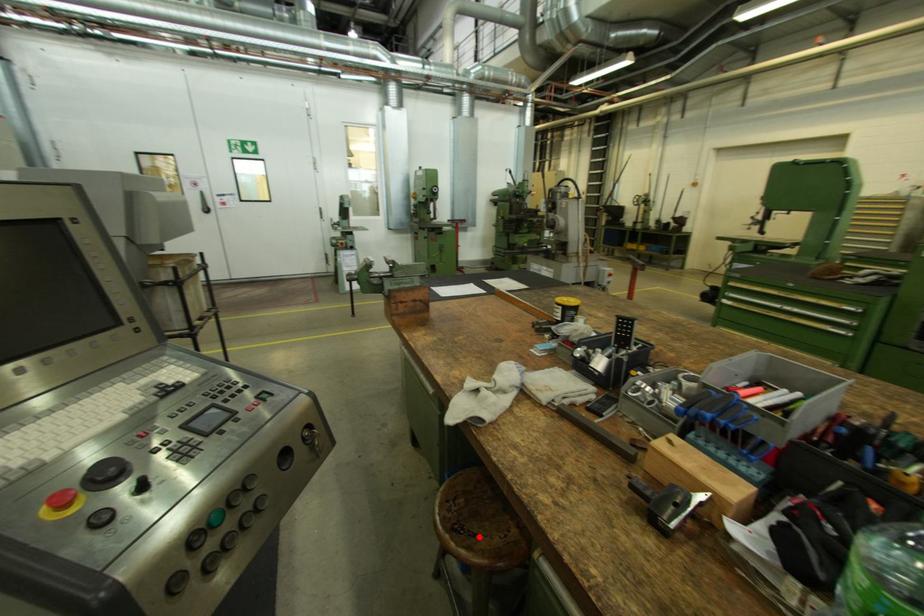
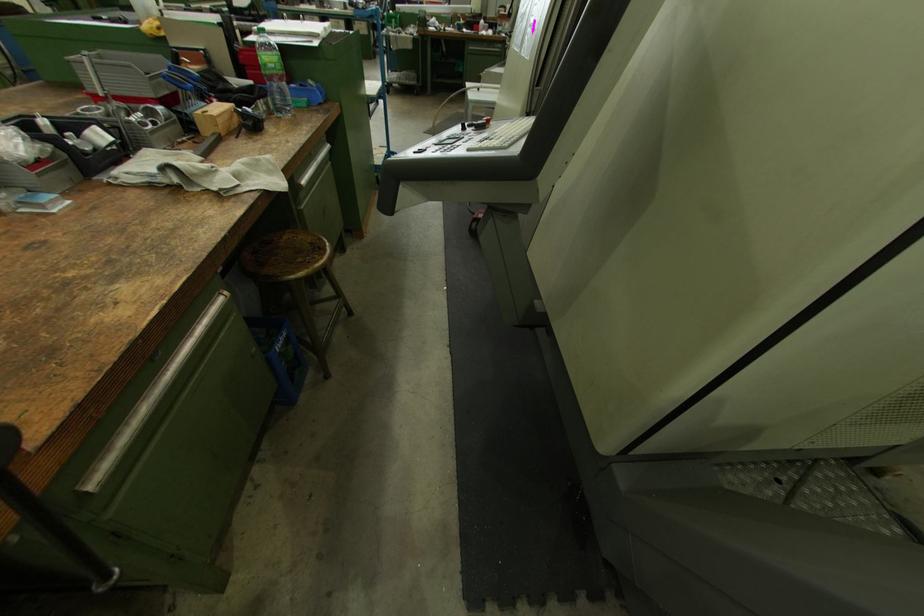
Question: I am providing you with two images of the same scene from different viewpoints. A red point is shown in image1. For the corresponding object point in image2, is it positioned nearer or farther from the camera?

Choices:
 (A) Nearer
 (B) Farther

Answer: (A)